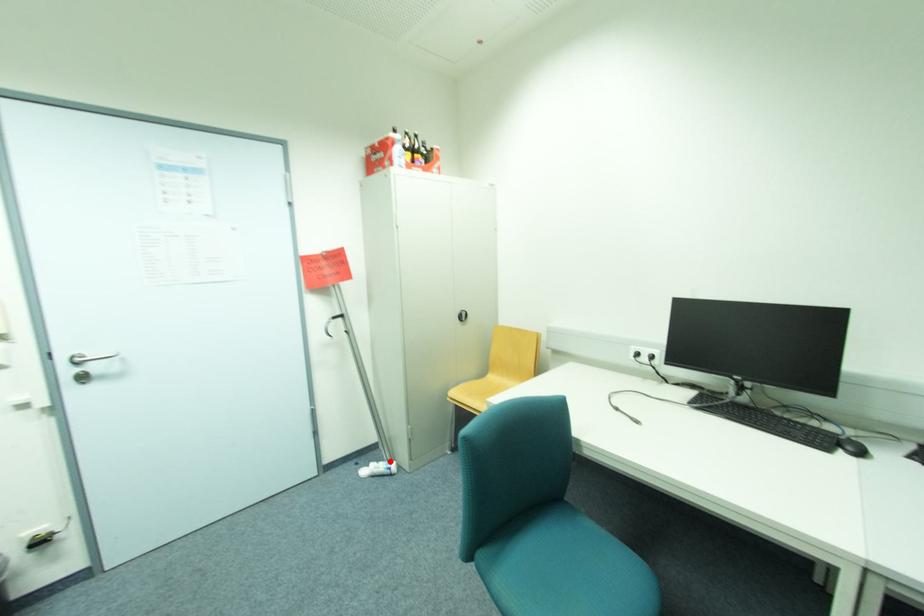
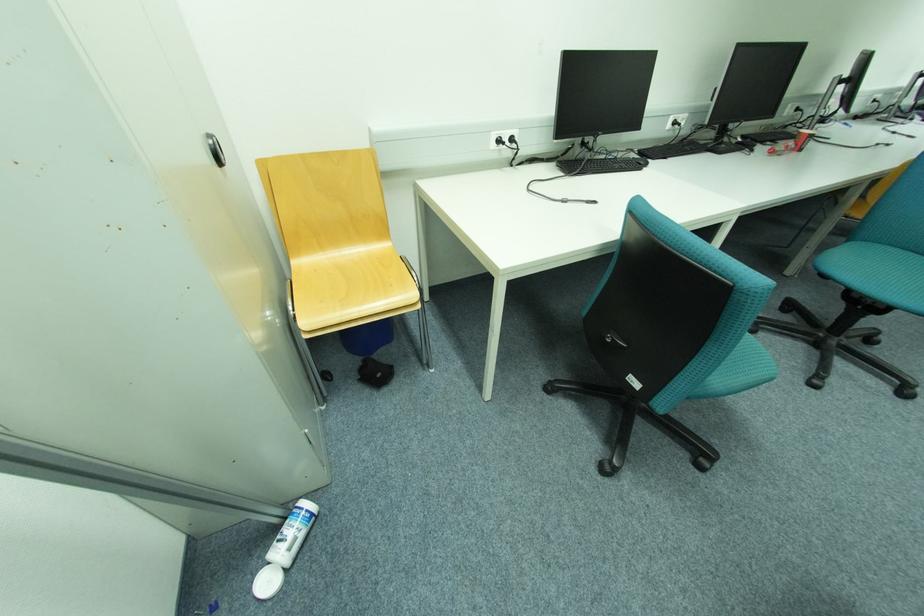
In the second image, find the point that corresponds to the highlighted location in the first image.

(287, 525)